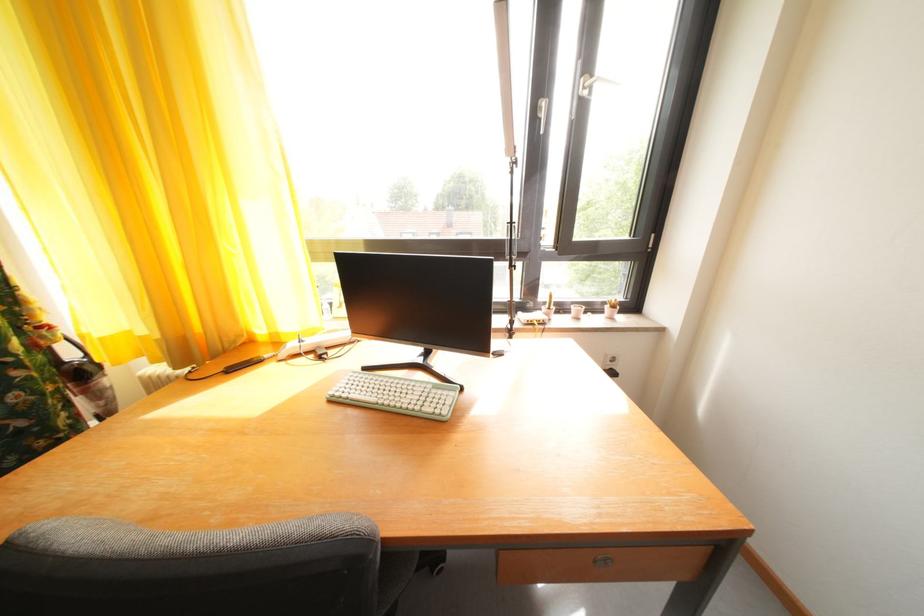
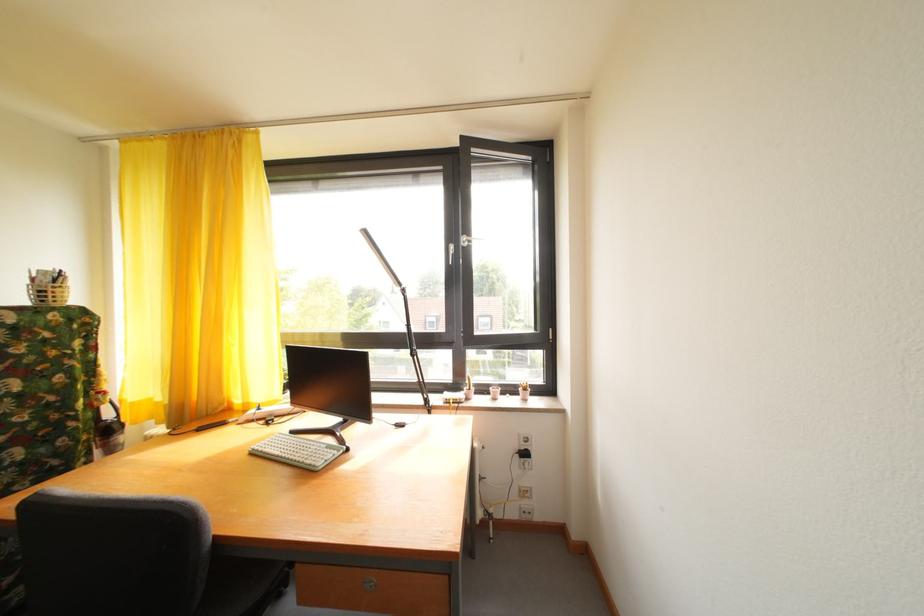
In the second image, find the point that corresponds to [373,374] in the first image.

(301, 438)